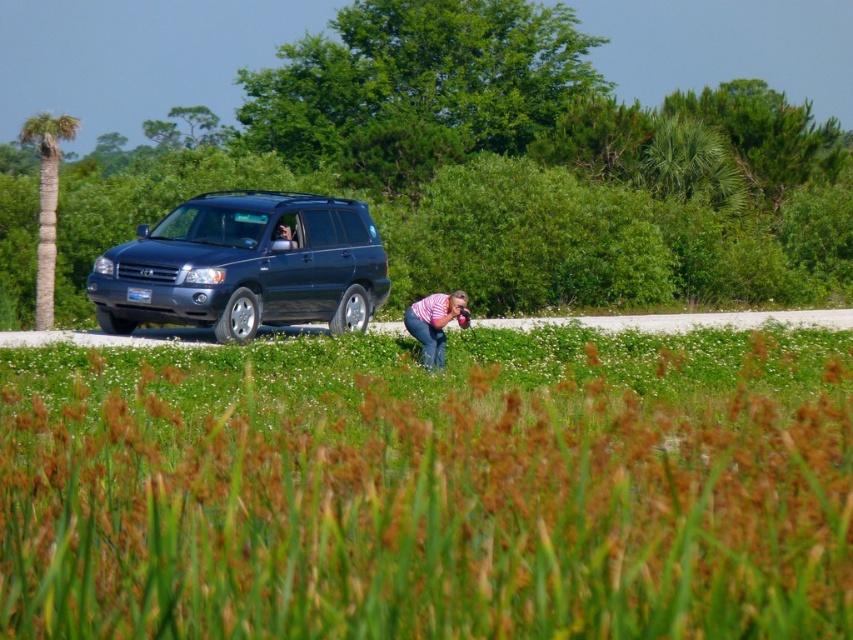
You are a photographer trying to capture a clear shot of the shiny dark blue suv at center. However, the green grass at center is blocking part of the view. Based on their heights, can you determine which one is taller and needs to be moved or trimmed to get a clear shot?

The shiny dark blue suv at center is taller than the green grass at center, so the green grass at center needs to be moved or trimmed to get a clear shot.

In the scene shown: You are standing in front of the dark SUV parked on the paved area. You notice two points marked on the ground near the vehicle. The first point is at coordinates point (277, 314) and the second point is at point (451, 292). Which point is closer to you?

The point at coordinates point (277, 314) is closer to you than the point at (451, 292).